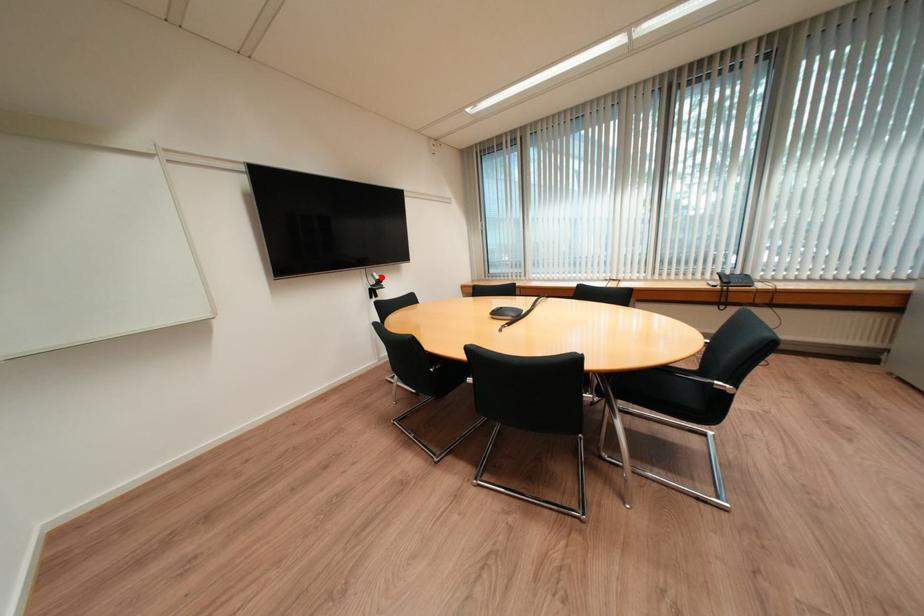
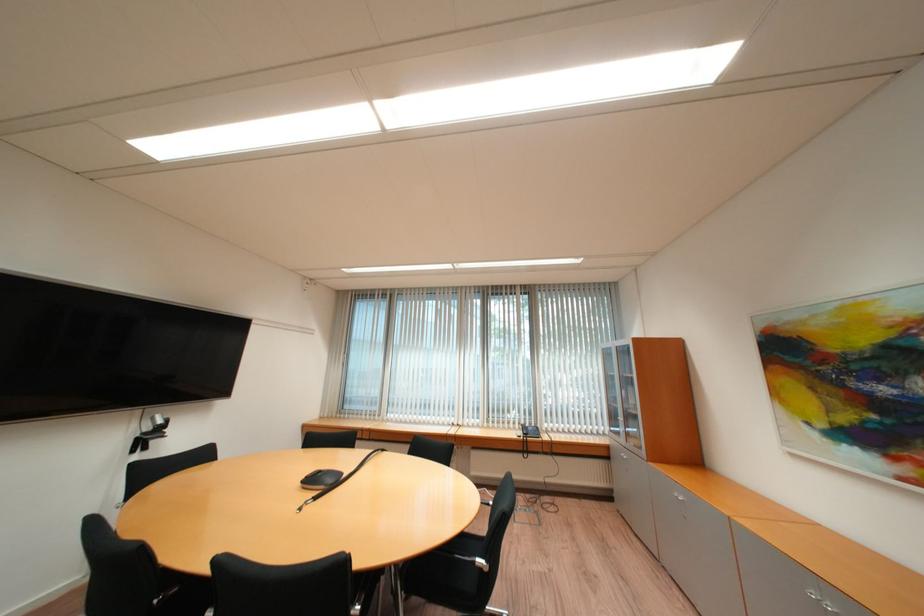
Question: I am providing you with two images of the same scene from different viewpoints. In image1, a red point is highlighted. Considering the same 3D point in image2, which of the following is correct?

Choices:
 (A) It is closer
 (B) It is farther

Answer: (B)